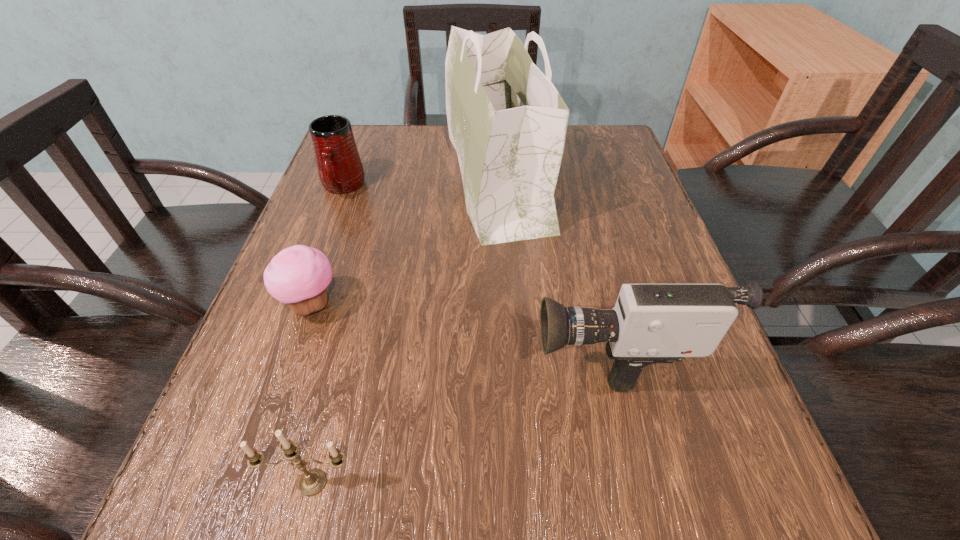
Identify the location of the tallest object. The height and width of the screenshot is (540, 960). (507, 122).

Image resolution: width=960 pixels, height=540 pixels. Identify the location of camcorder. (651, 323).

I want to click on mug, so click(340, 169).

Locate an element on the screen. candle is located at coordinates (313, 481).

This screenshot has height=540, width=960. Find the location of `cupcake`. cupcake is located at coordinates (298, 276).

The width and height of the screenshot is (960, 540). What are the coordinates of `free space located 0.120m on the front of the tallest object` in the screenshot? It's located at (502, 291).

The height and width of the screenshot is (540, 960). I want to click on vacant area situated 0.220m on the recording direction of the camcorder, so click(x=392, y=349).

Identify the location of free space located 0.380m on the recording direction of the camcorder. (291, 349).

At what (x,y) coordinates should I click in order to perform the action: click on vacant region located 0.110m on the recording direction of the camcorder. Please return your answer as a coordinate pair (x, y). Looking at the image, I should click on (462, 349).

Locate an element on the screen. The width and height of the screenshot is (960, 540). free space located on the side of the mug with the handle is located at coordinates (328, 226).